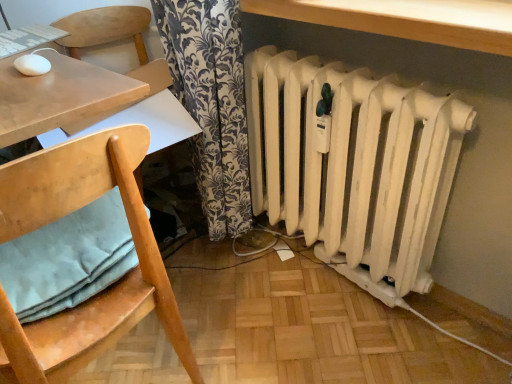
Question: Is white matte radiator at lower right taller or shorter than light blue fabric pillow at lower left?

Choices:
 (A) tall
 (B) short

Answer: (A)

Question: From the image's perspective, is white matte radiator at lower right located above or below light blue fabric pillow at lower left?

Choices:
 (A) above
 (B) below

Answer: (A)

Question: Estimate the real-world distances between objects in this image. Which object is closer to the wooden table at upper center?

Choices:
 (A) white matte radiator at lower right
 (B) light blue fabric pillow at lower left
 (C) wooden chair with cushion at left

Answer: (A)

Question: Which is farther from the light blue fabric pillow at lower left?

Choices:
 (A) wooden chair with cushion at left
 (B) wooden table at upper center
 (C) white matte radiator at lower right

Answer: (B)